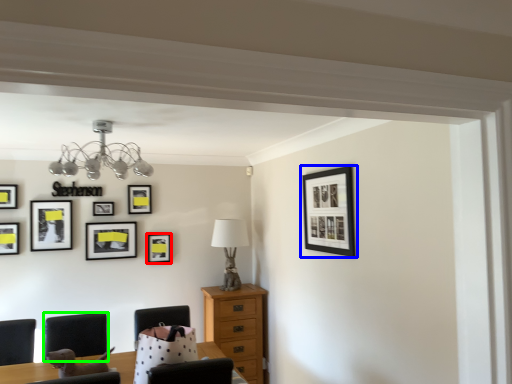
Question: Which object is positioned farthest from picture frame (highlighted by a red box)? Select from picture frame (highlighted by a blue box) and armchair (highlighted by a green box).

Choices:
 (A) picture frame
 (B) armchair

Answer: (A)